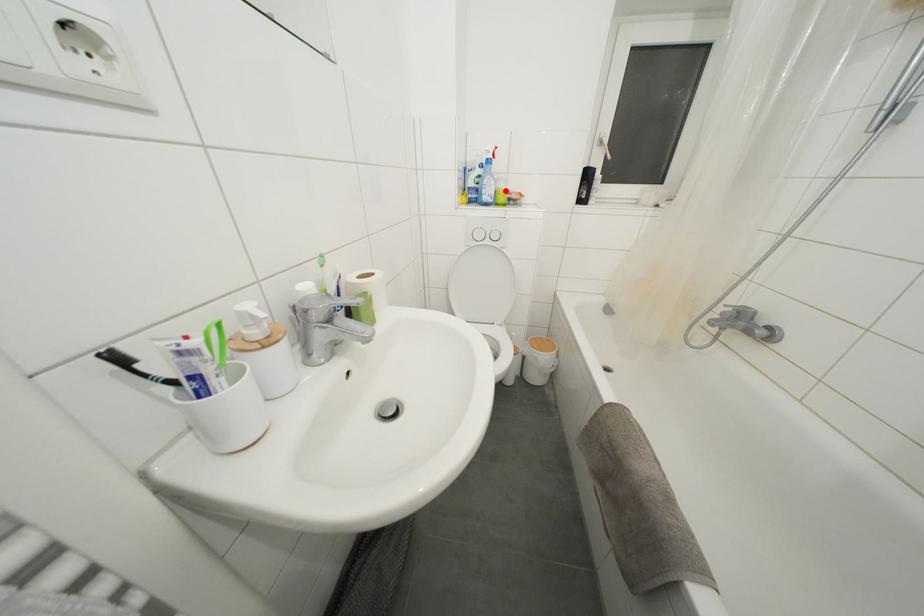
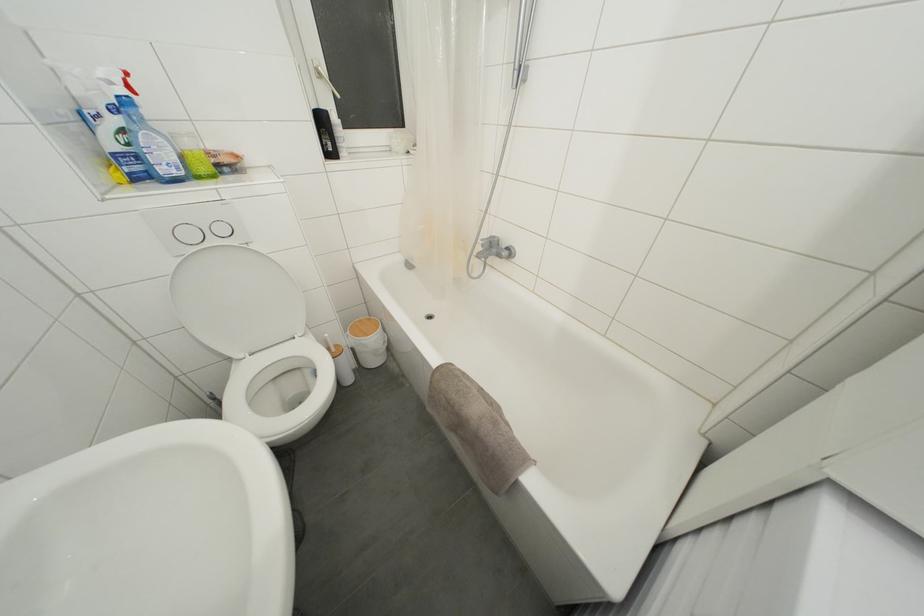
In the second image, find the point that corresponds to the highlighted location in the first image.

(193, 148)